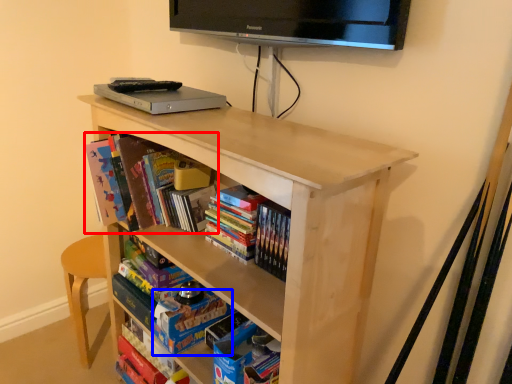
Question: Which object appears farthest to the camera in this image, book (highlighted by a red box) or paperback book (highlighted by a blue box)?

Choices:
 (A) book
 (B) paperback book

Answer: (B)